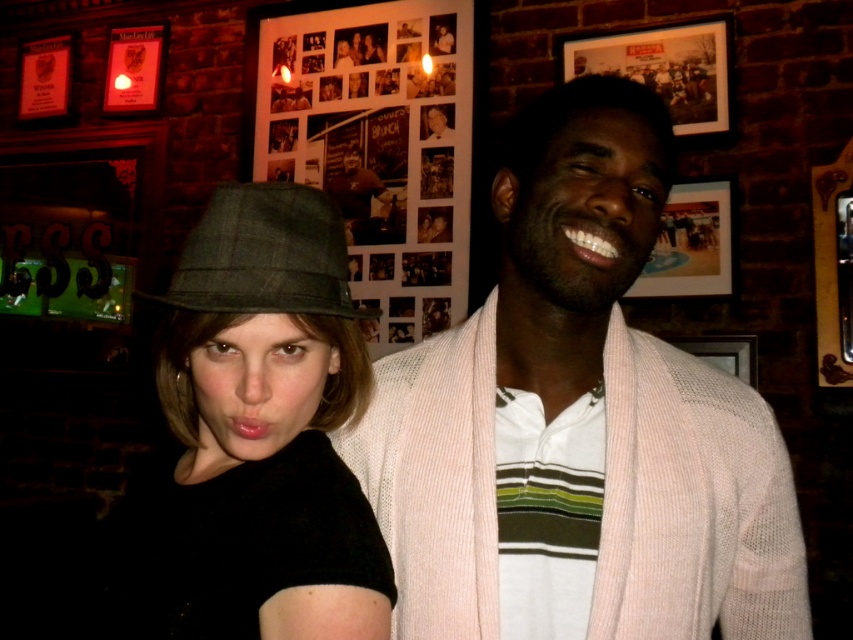
Between pink knit cardigan at center and green plaid fedora at left, which one is positioned lower?

pink knit cardigan at center is below.

Is pink knit cardigan at center wider than green plaid fedora at left?

Yes, pink knit cardigan at center is wider than green plaid fedora at left.

Who is more forward, [665,419] or [276,216]?

Point [276,216]

Find the location of a particular element. pink knit cardigan at center is located at coordinates (583, 410).

Between green plaid fedora at left and smooth skin face at center, which one is positioned lower?

Positioned lower is green plaid fedora at left.

Can you confirm if green plaid fedora at left is positioned to the left of smooth skin face at center?

Yes, green plaid fedora at left is to the left of smooth skin face at center.

In order to click on green plaid fedora at left in this screenshot , I will do `click(265, 253)`.

You are a GUI agent. You are given a task and a screenshot of the screen. Output one action in this format:
    pyautogui.click(x=<x>, y=<y>)
    Task: Click on the green plaid fedora at left
    
    Given the screenshot: What is the action you would take?
    pyautogui.click(x=265, y=253)

Is plaid fabric hat at center further to camera compared to smooth skin face at center?

No, it is in front of smooth skin face at center.

Is point (277, 605) closer to viewer compared to point (444, 115)?

Yes.

The height and width of the screenshot is (640, 853). I want to click on plaid fabric hat at center, so click(258, 436).

Identify the location of plaid fabric hat at center. This screenshot has height=640, width=853. (258, 436).